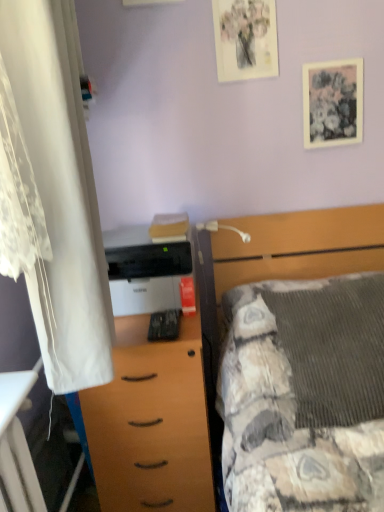
Where is `white matte printer at center`? white matte printer at center is located at coordinates 145,270.

What is the approximate width of white lace curtain at left?

The width of white lace curtain at left is 16.74 centimeters.

Describe the element at coordinates (17, 445) in the screenshot. I see `wooden desk at lower left` at that location.

Looking at this image, what is the approximate height of wooden desk at lower left?

It is 15.23 inches.

This screenshot has width=384, height=512. I want to click on white matte printer at center, so click(145, 270).

Looking at this image, from the image's perspective, which one is positioned higher, wooden desk at lower left or textured gray blanket at center?

textured gray blanket at center appears higher in the image.

Consider the image. How much distance is there between wooden desk at lower left and textured gray blanket at center?

34.57 inches.

Looking at this image, is wooden desk at lower left bigger or smaller than textured gray blanket at center?

wooden desk at lower left is smaller than textured gray blanket at center.

Which point is more forward, (5, 462) or (349, 230)?

The point (5, 462) is closer.

Would you say white plastic lamp at upper center is to the left or to the right of white matte printer at center in the picture?

From the image, it's evident that white plastic lamp at upper center is to the right of white matte printer at center.

Could white matte printer at center be considered to be inside white plastic lamp at upper center?

No, white plastic lamp at upper center does not contain white matte printer at center.

Between white plastic lamp at upper center and white matte printer at center, which one has more height?

white matte printer at center.

Considering the positions of point (244, 241) and point (151, 279), is point (244, 241) closer or farther from the camera than point (151, 279)?

Point (244, 241) appears to be farther away from the viewer than point (151, 279).

Does point (288, 259) appear closer or farther from the camera than point (208, 228)?

Point (288, 259) is closer to the camera than point (208, 228).

From the picture: Who is more distant, textured gray blanket at center or white plastic lamp at upper center?

Positioned behind is white plastic lamp at upper center.

Between textured gray blanket at center and white plastic lamp at upper center, which one has larger width?

Wider between the two is white plastic lamp at upper center.

From the image's perspective, is white matte printer at center beneath wooden chest of drawers at center?

No.

Would you say white matte printer at center contains wooden chest of drawers at center?

That's incorrect, wooden chest of drawers at center is not inside white matte printer at center.

Considering the points (123, 254) and (103, 492), which point is behind, point (123, 254) or point (103, 492)?

Positioned behind is point (103, 492).

Can you confirm if white matte printer at center is positioned to the left of wooden chest of drawers at center?

Yes, white matte printer at center is to the left of wooden chest of drawers at center.

Considering the relative sizes of textured gray blanket at center and white matte printer at center in the image provided, is textured gray blanket at center taller than white matte printer at center?

Yes, textured gray blanket at center is taller than white matte printer at center.

From a real-world perspective, who is located lower, textured gray blanket at center or white matte printer at center?

textured gray blanket at center is physically lower.

Locate an element on the screen. This screenshot has width=384, height=512. bed lying below the white matte printer at center (from the image's perspective) is located at coordinates (285, 254).

Does point (199, 226) appear closer or farther from the camera than point (248, 45)?

Point (199, 226) appears to be farther away from the viewer than point (248, 45).

I want to click on the 2nd picture frame directly above the white plastic lamp at upper center (from a real-world perspective), so click(245, 39).

Is white plastic lamp at upper center positioned far away from matte floral print at upper center, placed as the first picture frame when sorted from top to bottom?

No, white plastic lamp at upper center is not far away from matte floral print at upper center, placed as the first picture frame when sorted from top to bottom.

Is white plastic lamp at upper center surrounding matte floral print at upper center, the first picture frame viewed from the left?

Actually, matte floral print at upper center, the first picture frame viewed from the left, is outside white plastic lamp at upper center.

How distant is matte paper picture frame at upper right, the first picture frame from the right, from textured gray blanket at center?

The distance of matte paper picture frame at upper right, the first picture frame from the right, from textured gray blanket at center is 18.47 inches.

Is the depth of matte paper picture frame at upper right, which ranks as the 1th picture frame in bottom-to-top order, greater than that of textured gray blanket at center?

Yes.

Is textured gray blanket at center at the back of matte paper picture frame at upper right, acting as the 2th picture frame starting from the left?

matte paper picture frame at upper right, acting as the 2th picture frame starting from the left, does not have its back to textured gray blanket at center.

Is matte paper picture frame at upper right, which ranks as the 1th picture frame in bottom-to-top order, at the left side of textured gray blanket at center?

In fact, matte paper picture frame at upper right, which ranks as the 1th picture frame in bottom-to-top order, is to the right of textured gray blanket at center.

Where is `desk lying on the left of textured gray blanket at center`? This screenshot has height=512, width=384. desk lying on the left of textured gray blanket at center is located at coordinates (17, 445).

Locate an element on the screen. The height and width of the screenshot is (512, 384). lamp that appears behind the white matte printer at center is located at coordinates (222, 228).

From the picture: From the image, which object appears to be nearer to wooden chest of drawers at center, textured gray blanket at center or matte floral print at upper center, arranged as the second picture frame when viewed from the right?

Among the two, textured gray blanket at center is located nearer to wooden chest of drawers at center.

Looking at the image, which one is located closer to white plastic lamp at upper center, wooden desk at lower left or matte paper picture frame at upper right, the second picture frame in the top-to-bottom sequence?

The object closer to white plastic lamp at upper center is matte paper picture frame at upper right, the second picture frame in the top-to-bottom sequence.

Based on their spatial positions, is matte floral print at upper center, arranged as the second picture frame when viewed from the right, or white plastic lamp at upper center closer to white matte printer at center?

white plastic lamp at upper center is positioned closer to the anchor white matte printer at center.

Based on their spatial positions, is white lace curtain at left or wooden chest of drawers at center further from matte paper picture frame at upper right, the first picture frame from the right?

wooden chest of drawers at center is further to matte paper picture frame at upper right, the first picture frame from the right.

Looking at the image, which one is located further to white lace curtain at left, matte paper picture frame at upper right, acting as the 2th picture frame starting from the left, or textured gray blanket at center?

Based on the image, matte paper picture frame at upper right, acting as the 2th picture frame starting from the left, appears to be further to white lace curtain at left.

From the picture: Estimate the real-world distances between objects in this image. Which object is closer to white matte printer at center, wooden chest of drawers at center or matte floral print at upper center, the first picture frame viewed from the left?

wooden chest of drawers at center is closer to white matte printer at center.

Based on their spatial positions, is wooden desk at lower left or wooden chest of drawers at center closer to textured gray blanket at center?

Based on the image, wooden chest of drawers at center appears to be nearer to textured gray blanket at center.

When comparing their distances from white lace curtain at left, does white matte printer at center or white plastic lamp at upper center seem closer?

Among the two, white matte printer at center is located nearer to white lace curtain at left.

Locate an element on the screen. The width and height of the screenshot is (384, 512). lamp between matte floral print at upper center, arranged as the second picture frame when viewed from the right, and textured gray blanket at center, in the vertical direction is located at coordinates (222, 228).

This screenshot has width=384, height=512. I want to click on picture frame between matte floral print at upper center, arranged as the 2th picture frame when ordered from the bottom, and white plastic lamp at upper center vertically, so click(x=333, y=103).

Find the location of a particular element. This screenshot has width=384, height=512. printer between matte paper picture frame at upper right, the first picture frame from the right, and textured gray blanket at center, in the vertical direction is located at coordinates (145, 270).

Locate an element on the screen. Image resolution: width=384 pixels, height=512 pixels. lamp located between white lace curtain at left and matte floral print at upper center, placed as the first picture frame when sorted from top to bottom, in the depth direction is located at coordinates (222, 228).